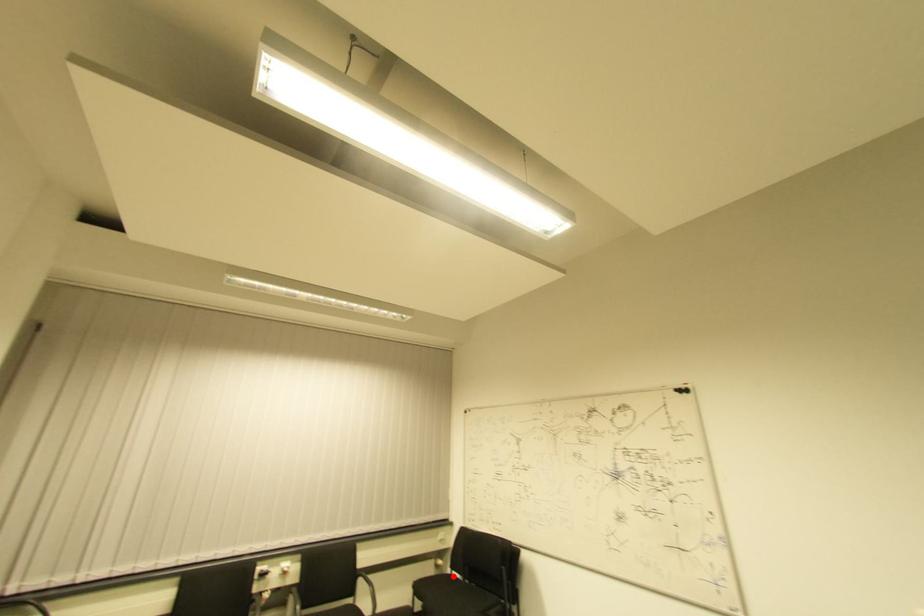
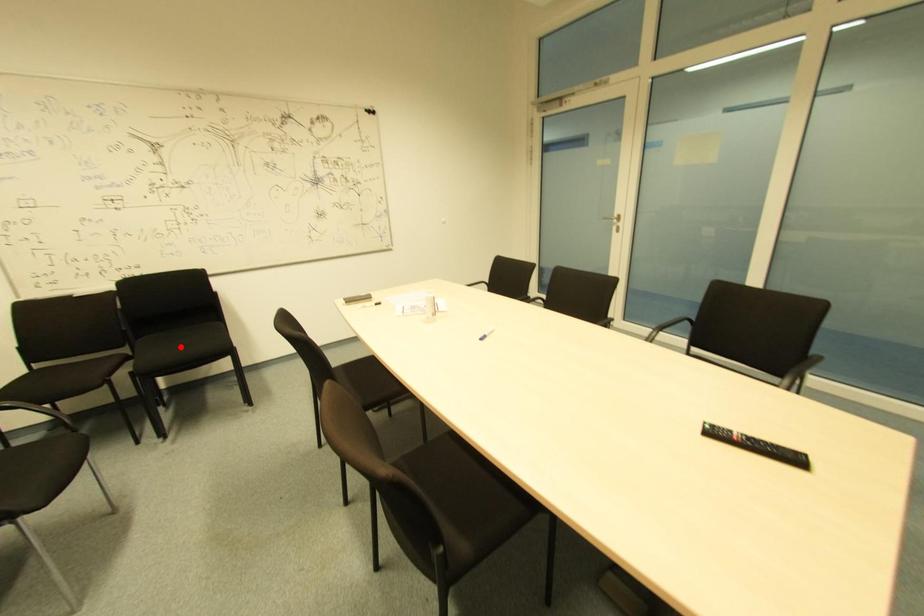
I am providing you with two images of the same scene from different viewpoints. A red point is marked on the first image and another point is marked on the second image. Do the highlighted points in image1 and image2 indicate the same real-world spot?

No